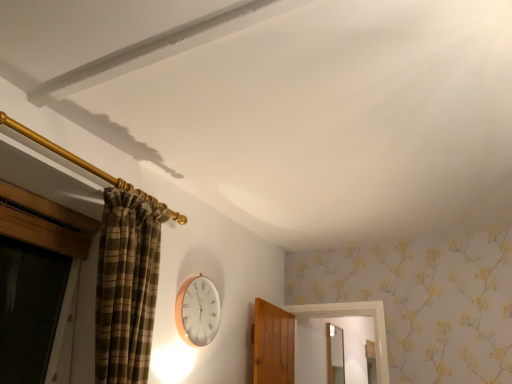
Question: Is matte silver mirror at center at the right side of white wooden clock at center?

Choices:
 (A) no
 (B) yes

Answer: (B)

Question: Could you tell me if matte silver mirror at center is facing white wooden clock at center?

Choices:
 (A) no
 (B) yes

Answer: (A)

Question: Is matte silver mirror at center positioned before white wooden clock at center?

Choices:
 (A) no
 (B) yes

Answer: (A)

Question: From a real-world perspective, is matte silver mirror at center located beneath white wooden clock at center?

Choices:
 (A) no
 (B) yes

Answer: (A)

Question: Does matte silver mirror at center have a smaller size compared to white wooden clock at center?

Choices:
 (A) yes
 (B) no

Answer: (B)

Question: From the image's perspective, is matte silver mirror at center under white wooden clock at center?

Choices:
 (A) no
 (B) yes

Answer: (B)

Question: Is white wooden clock at center outside matte silver mirror at center?

Choices:
 (A) yes
 (B) no

Answer: (A)

Question: From the image's perspective, is white wooden clock at center above matte silver mirror at center?

Choices:
 (A) yes
 (B) no

Answer: (A)

Question: Is white wooden clock at center to the right of matte silver mirror at center from the viewer's perspective?

Choices:
 (A) yes
 (B) no

Answer: (B)

Question: Considering the relative positions of white wooden clock at center and matte silver mirror at center in the image provided, is white wooden clock at center to the left of matte silver mirror at center from the viewer's perspective?

Choices:
 (A) yes
 (B) no

Answer: (A)

Question: Does white wooden clock at center have a lesser height compared to matte silver mirror at center?

Choices:
 (A) no
 (B) yes

Answer: (B)

Question: Is white wooden clock at center far away from matte silver mirror at center?

Choices:
 (A) no
 (B) yes

Answer: (B)

Question: Based on their sizes in the image, would you say white wooden clock at center is bigger or smaller than matte silver mirror at center?

Choices:
 (A) big
 (B) small

Answer: (B)